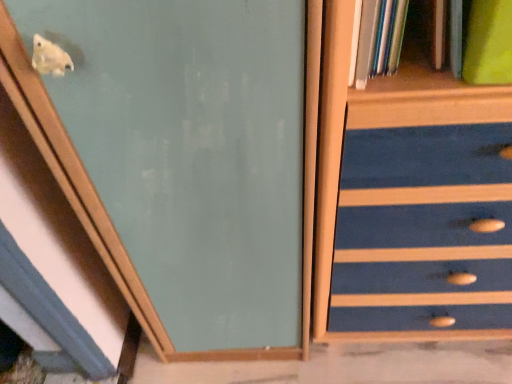
The width and height of the screenshot is (512, 384). Identify the location of wooden bookshelf at upper right. (376, 39).

In order to face wooden bookshelf at upper right, should I rotate leftwards or rightwards?

Rotate your view right by about 17.804°.

Image resolution: width=512 pixels, height=384 pixels. Describe the element at coordinates (376, 39) in the screenshot. I see `wooden bookshelf at upper right` at that location.

Identify the location of wooden bookshelf at upper right. (376, 39).